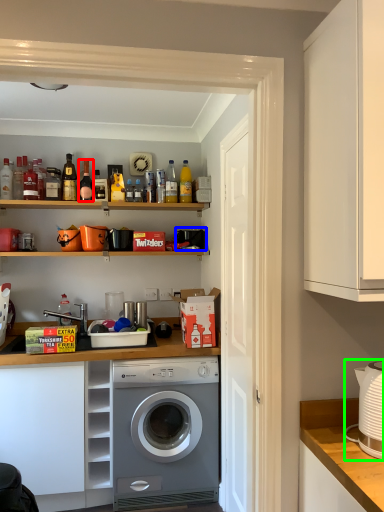
Question: Which is nearer to the bottle (highlighted by a red box)? appliance (highlighted by a blue box) or appliance (highlighted by a green box).

Choices:
 (A) appliance
 (B) appliance

Answer: (A)